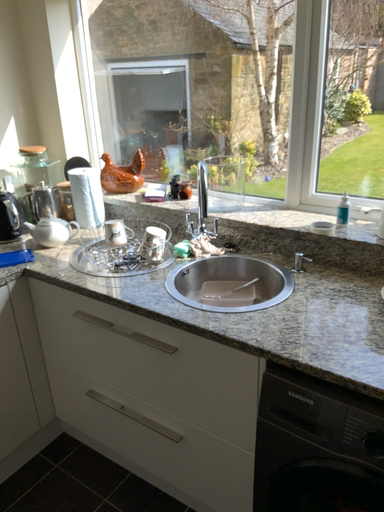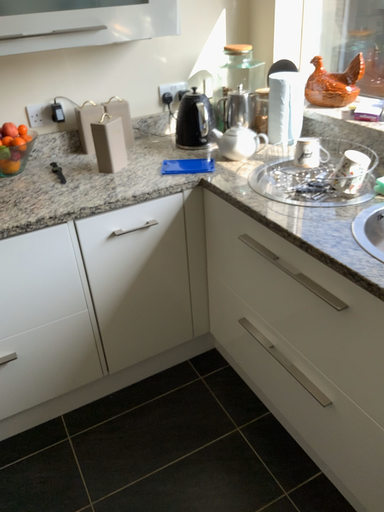
Question: How did the camera likely rotate when shooting the video?

Choices:
 (A) rotated upward
 (B) rotated downward

Answer: (B)